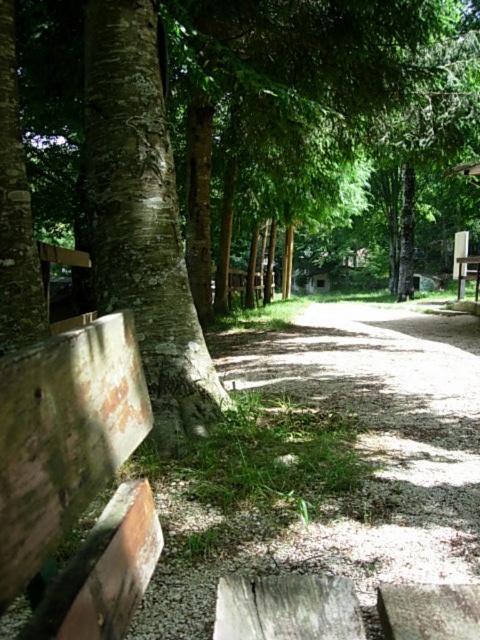
Describe the element at coordinates (213, 124) in the screenshot. The width and height of the screenshot is (480, 640). I see `rough bark tree at left` at that location.

Between rough bark tree at left and gravel path at center, which one is positioned lower?

gravel path at center

I want to click on rough bark tree at left, so click(213, 124).

Locate an element on the screen. The width and height of the screenshot is (480, 640). rough bark tree at left is located at coordinates (213, 124).

Which of these two, rough bark tree at left or wooden picnic table at center, stands shorter?

wooden picnic table at center is shorter.

Does rough bark tree at left have a greater width compared to wooden picnic table at center?

Yes.

Describe the element at coordinates (213, 124) in the screenshot. I see `rough bark tree at left` at that location.

Identify the location of rough bark tree at left. (213, 124).

Does rusty wood bench at lower left appear on the left side of wooden picnic table at center?

Indeed, rusty wood bench at lower left is positioned on the left side of wooden picnic table at center.

At what (x,y) coordinates should I click in order to perform the action: click on rusty wood bench at lower left. Please return your answer as a coordinate pair (x, y). Looking at the image, I should click on [x=63, y=435].

Between point (99, 486) and point (460, 294), which one is positioned in front?

Point (99, 486) is more forward.

Find the location of a particular element. This screenshot has height=640, width=480. rusty wood bench at lower left is located at coordinates (63, 435).